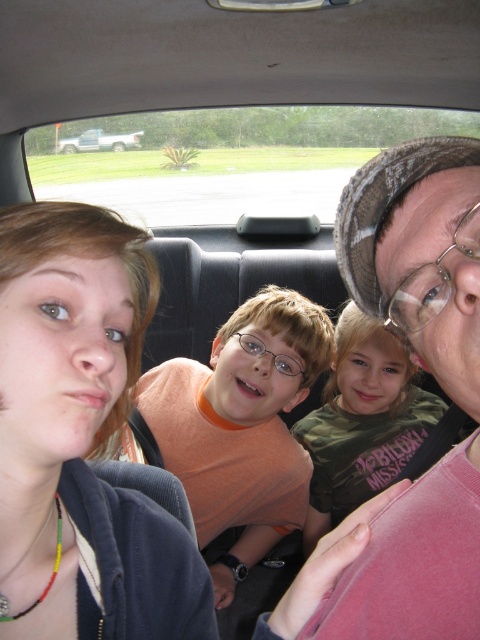
Question: Among these points, which one is nearest to the camera?

Choices:
 (A) (197, 403)
 (B) (356, 202)

Answer: (B)

Question: Is matte blue hoodie at left above pink fabric at upper right?

Choices:
 (A) yes
 (B) no

Answer: (B)

Question: Can you confirm if orange t-shirt at center is positioned to the left of camouflage fabric shirt at center?

Choices:
 (A) no
 (B) yes

Answer: (B)

Question: Observing the image, what is the correct spatial positioning of pink fabric at upper right in reference to camouflage fabric shirt at center?

Choices:
 (A) above
 (B) below

Answer: (A)

Question: Among these points, which one is farthest from the camera?

Choices:
 (A) (64, 524)
 (B) (81, 147)

Answer: (B)

Question: Which object appears closest to the camera in this image?

Choices:
 (A) orange t-shirt at center
 (B) camouflage fabric shirt at center
 (C) silver metallic truck at rear left
 (D) matte blue hoodie at left

Answer: (D)